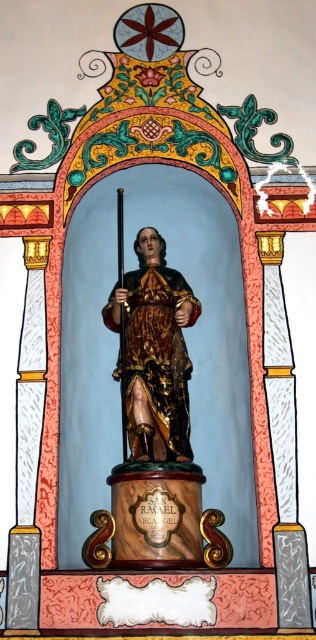
Question: Which point is closer to the camera taking this photo?

Choices:
 (A) (113, 538)
 (B) (137, 339)

Answer: (A)

Question: Which object appears farthest from the camera in this image?

Choices:
 (A) gold/ornate fabric robe at center
 (B) gold polished statue at center

Answer: (A)

Question: Can you confirm if gold polished statue at center is positioned below gold/ornate fabric robe at center?

Choices:
 (A) no
 (B) yes

Answer: (B)

Question: Is gold polished statue at center above gold/ornate fabric robe at center?

Choices:
 (A) no
 (B) yes

Answer: (A)

Question: Is gold polished statue at center positioned before gold/ornate fabric robe at center?

Choices:
 (A) yes
 (B) no

Answer: (A)